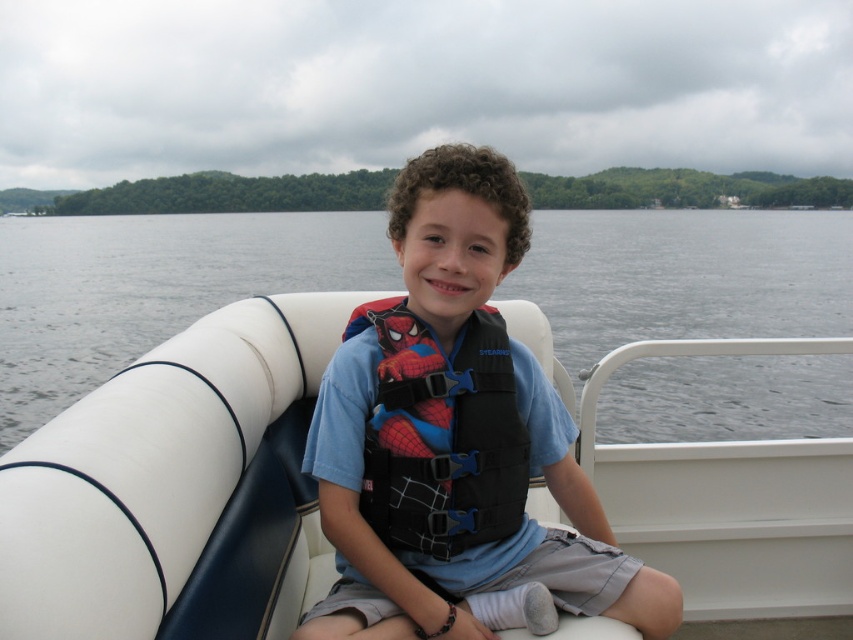
Based on the photo, does white vinyl boat at center have a lesser height compared to clear water at center?

Correct, white vinyl boat at center is not as tall as clear water at center.

Does white vinyl boat at center appear under clear water at center?

Yes.

I want to click on white vinyl boat at center, so pyautogui.click(x=173, y=486).

Where is `white vinyl boat at center`? The width and height of the screenshot is (853, 640). white vinyl boat at center is located at coordinates (173, 486).

Can you confirm if white vinyl boat at center is positioned below blue fabric life vest at center?

Indeed, white vinyl boat at center is positioned under blue fabric life vest at center.

Can you confirm if white vinyl boat at center is taller than blue fabric life vest at center?

Incorrect, white vinyl boat at center's height is not larger of blue fabric life vest at center's.

This screenshot has width=853, height=640. Find the location of `white vinyl boat at center`. white vinyl boat at center is located at coordinates (173, 486).

Is white vinyl boat at center above black fabric life jacket at center?

Incorrect, white vinyl boat at center is not positioned above black fabric life jacket at center.

Is point (91, 548) positioned in front of point (444, 365)?

Yes, it is in front of point (444, 365).

The height and width of the screenshot is (640, 853). Identify the location of white vinyl boat at center. (173, 486).